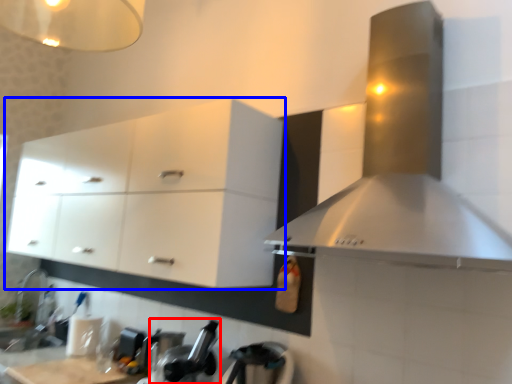
Question: Which object appears farthest to the camera in this image, appliance (highlighted by a red box) or cabinetry (highlighted by a blue box)?

Choices:
 (A) appliance
 (B) cabinetry

Answer: (A)